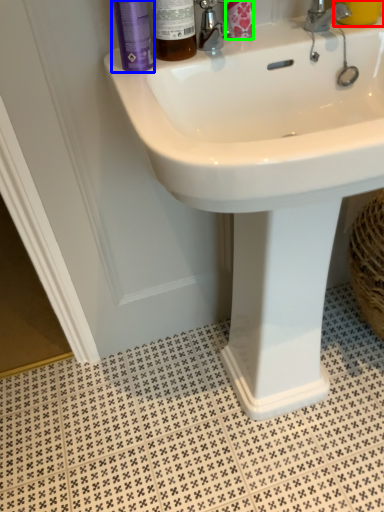
Question: Which object is positioned farthest from liquid (highlighted by a red box)? Select from mouthwash (highlighted by a blue box) and toiletry (highlighted by a green box).

Choices:
 (A) mouthwash
 (B) toiletry

Answer: (A)